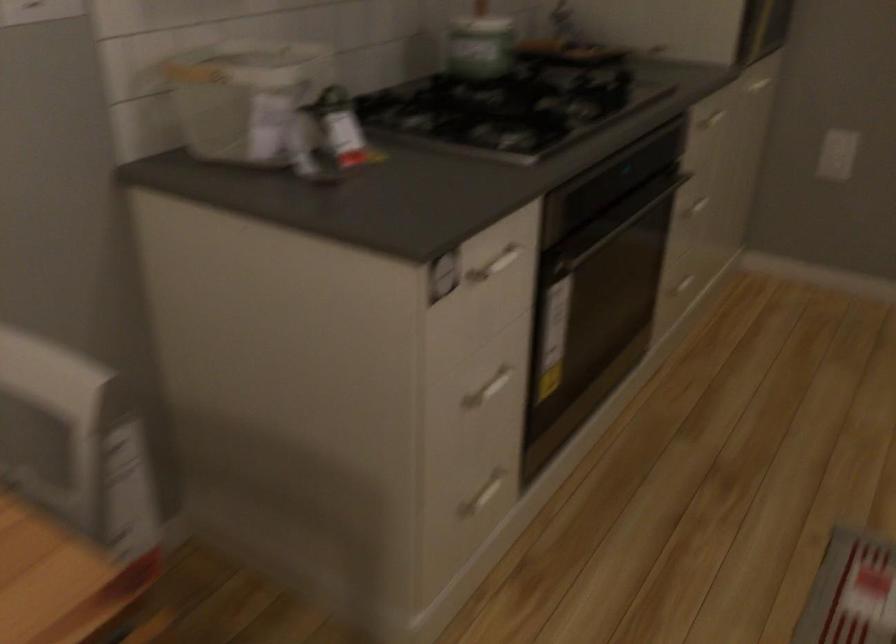
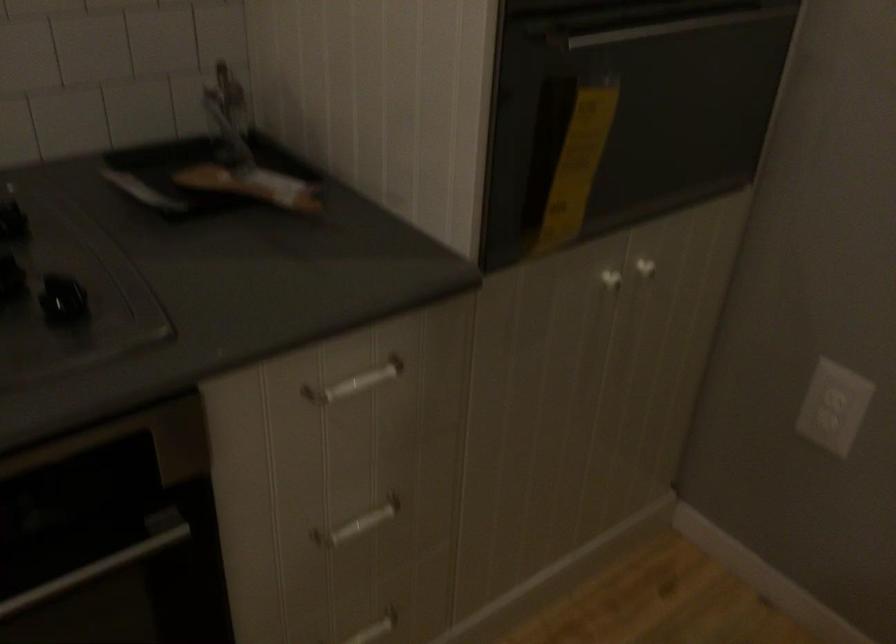
Find the pixel in the second image that matches point 694,209 in the first image.

(358, 524)